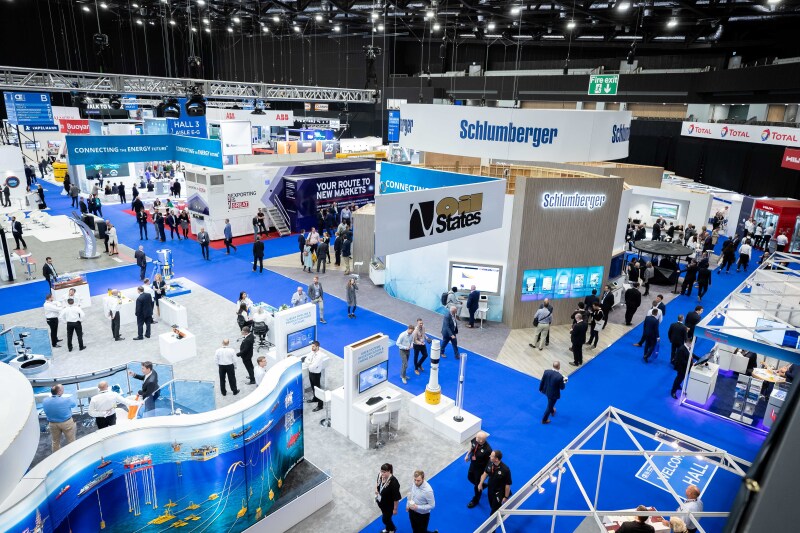
Where is `table`? This screenshot has width=800, height=533. table is located at coordinates (660, 248).